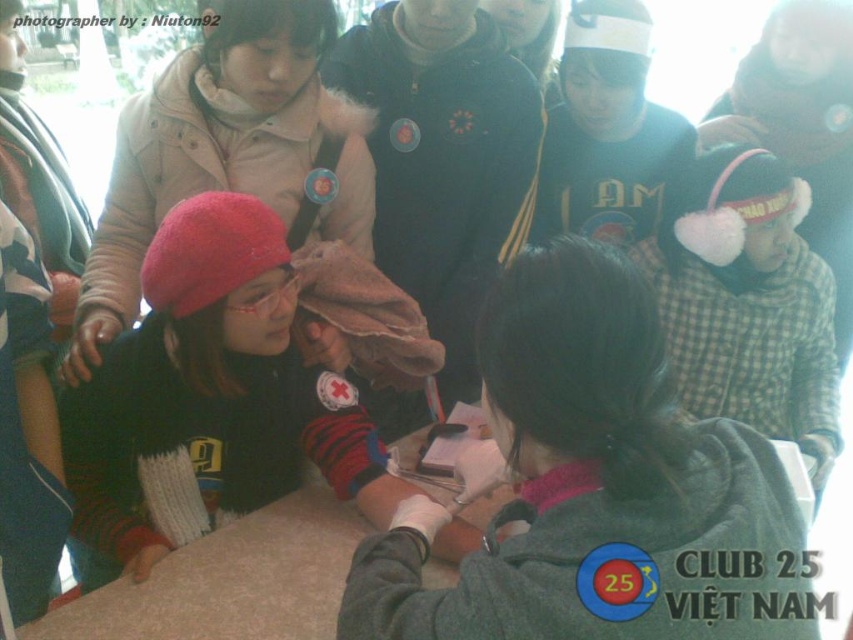
Which is above, plaid fabric at center or green cotton sweater at upper center?

green cotton sweater at upper center is above.

Who is taller, plaid fabric at center or green cotton sweater at upper center?

plaid fabric at center is taller.

Where is `plaid fabric at center`? plaid fabric at center is located at coordinates (747, 301).

Between matte red beanie at left and matte pink hat at left, which one appears on the left side from the viewer's perspective?

Positioned to the left is matte pink hat at left.

Between point (138, 577) and point (169, 76), which one is positioned behind?

The point (169, 76) is more distant.

In order to click on matte red beanie at left in this screenshot , I will do `click(212, 396)`.

The image size is (853, 640). In order to click on green fleece jacket at center in this screenshot , I will do `click(598, 488)`.

Which is below, green fleece jacket at center or matte red beanie at left?

green fleece jacket at center

Which is behind, point (753, 508) or point (352, 426)?

The point (352, 426) is more distant.

The image size is (853, 640). Find the location of `green fleece jacket at center`. green fleece jacket at center is located at coordinates (598, 488).